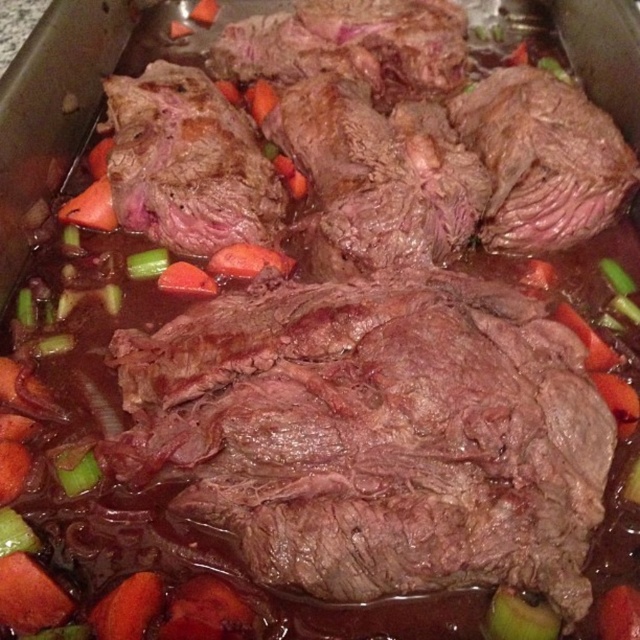
You are a chef trying to locate the carrot in the dish. The coordinates of the carrot are given as point (620, 612). If the bottom left corner of the baking tray is considered the origin point, can you determine the quadrant where the carrot is located?

The carrot is located at point (620, 612), which is in the upper right quadrant of the baking tray since both x and y coordinates are above 0.5.

You are arranging vegetables on a baking tray and see the green translucent onion at lower left and the green translucent celery at center. Which vegetable is located more to the left?

The green translucent onion at lower left is more to the left than the green translucent celery at center.